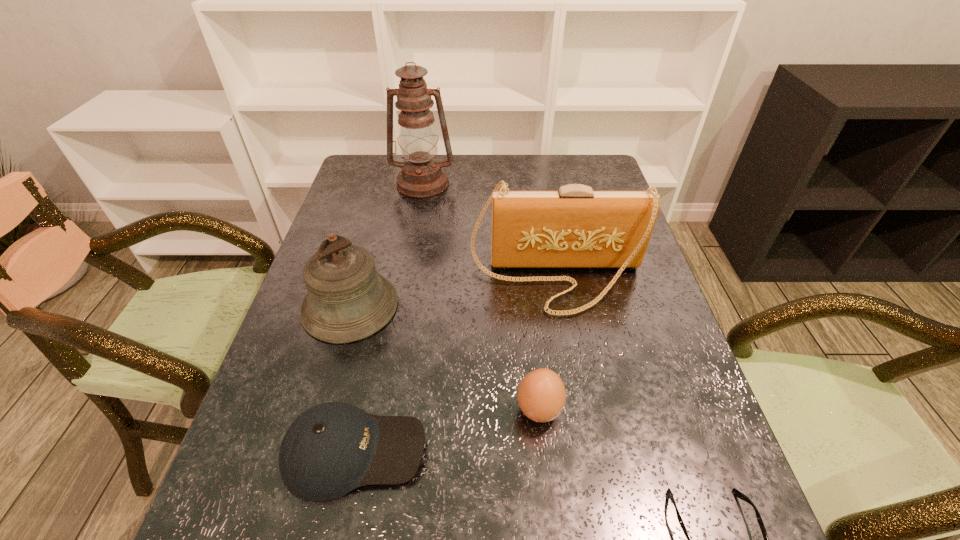
The width and height of the screenshot is (960, 540). Identify the location of vacant space located on the front-facing side of the second shortest object. (636, 451).

Image resolution: width=960 pixels, height=540 pixels. Find the location of `object present at the far edge`. object present at the far edge is located at coordinates 422,176.

What are the coordinates of `oil lamp that is at the left edge` in the screenshot? It's located at (422, 176).

Where is `bell present at the left edge`? The width and height of the screenshot is (960, 540). bell present at the left edge is located at coordinates (347, 301).

The height and width of the screenshot is (540, 960). I want to click on baseball cap located at the left edge, so click(x=332, y=448).

Find the location of a particular element. The height and width of the screenshot is (540, 960). object present at the right edge is located at coordinates (575, 227).

Where is `object at the far left corner`? This screenshot has width=960, height=540. object at the far left corner is located at coordinates (422, 176).

In the image, there is a desktop. Where is `vacant space at the far edge`? This screenshot has height=540, width=960. vacant space at the far edge is located at coordinates (449, 173).

Identify the location of vacant point at the near edge. (520, 526).

Where is `vacant space at the left edge of the desktop`? Image resolution: width=960 pixels, height=540 pixels. vacant space at the left edge of the desktop is located at coordinates (280, 379).